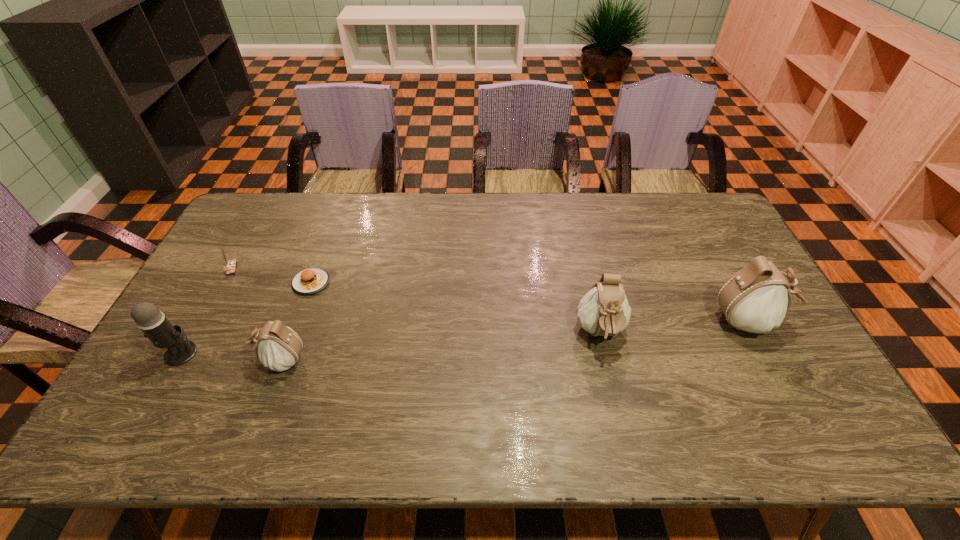
Where is `vacant space at the far edge`? This screenshot has width=960, height=540. vacant space at the far edge is located at coordinates (565, 201).

In the image, there is a desktop. Where is `vacant space at the near edge`? The width and height of the screenshot is (960, 540). vacant space at the near edge is located at coordinates (587, 379).

In the image, there is a desktop. Identify the location of vacant region at the left edge. This screenshot has height=540, width=960. point(238,265).

Image resolution: width=960 pixels, height=540 pixels. I want to click on vacant region at the right edge of the desktop, so click(x=799, y=346).

This screenshot has height=540, width=960. Find the location of `vacant space at the far left corner`. vacant space at the far left corner is located at coordinates (277, 222).

At what (x,y) coordinates should I click in order to perform the action: click on vacant space at the near right corner of the desktop. Please return your answer as a coordinate pair (x, y). The image size is (960, 540). Looking at the image, I should click on (792, 401).

The width and height of the screenshot is (960, 540). I want to click on vacant space that is in between the fifth tallest object and the microphone, so click(x=206, y=311).

Find the location of a particular element. free space between the shortest object and the microphone is located at coordinates (247, 318).

Find the location of a particular element. The width and height of the screenshot is (960, 540). free space between the third shortest object and the microphone is located at coordinates (231, 356).

This screenshot has height=540, width=960. Identify the location of empty location between the shortest pouch and the rightmost pouch. (515, 341).